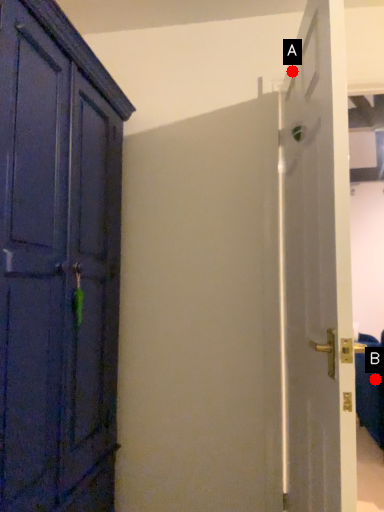
Question: Two points are circled on the image, labeled by A and B beside each circle. Which point is further to the camera?

Choices:
 (A) A is further
 (B) B is further

Answer: (B)